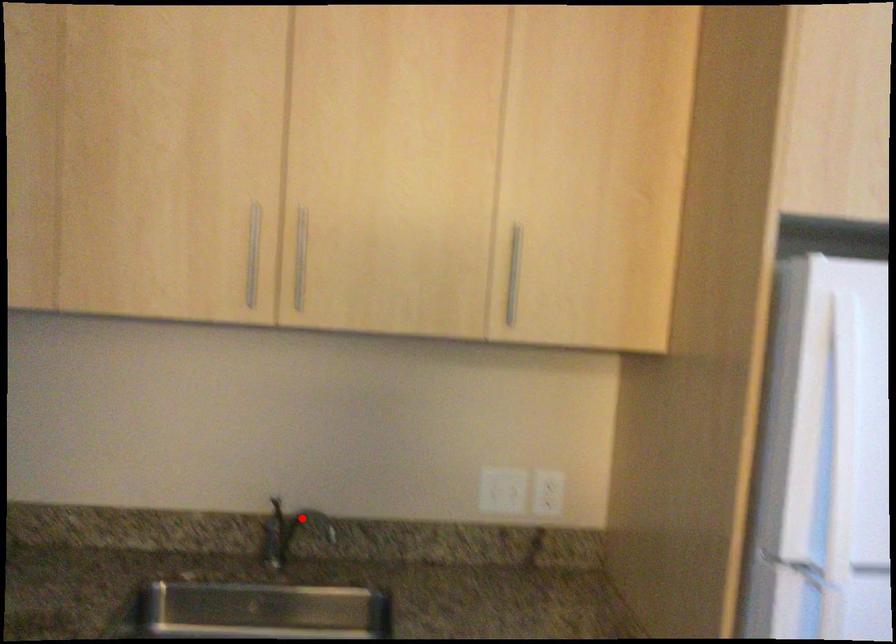
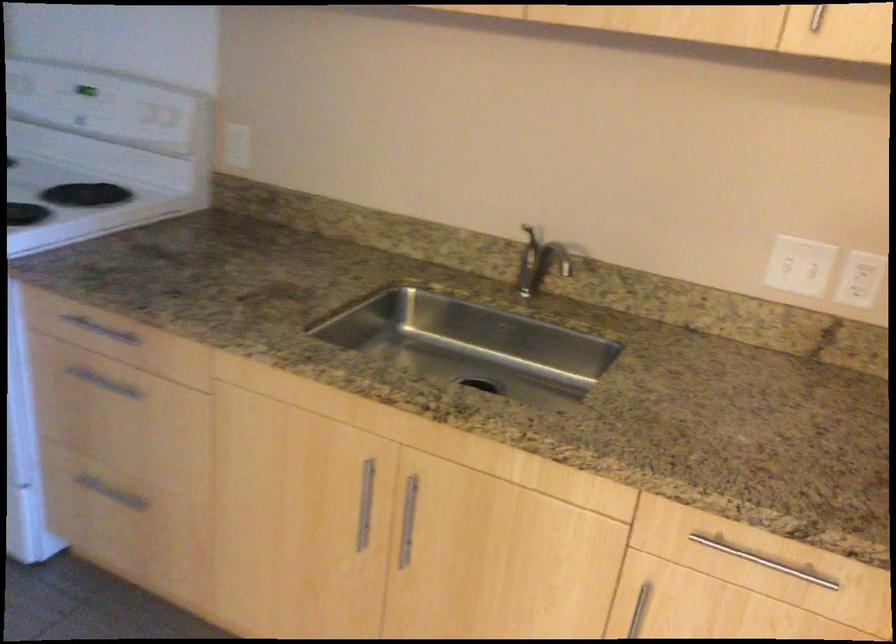
Question: I am providing you with two images of the same scene from different viewpoints. Given a red point in image1, look at the same physical point in image2. Is it:

Choices:
 (A) Closer to the viewpoint
 (B) Farther from the viewpoint

Answer: (A)